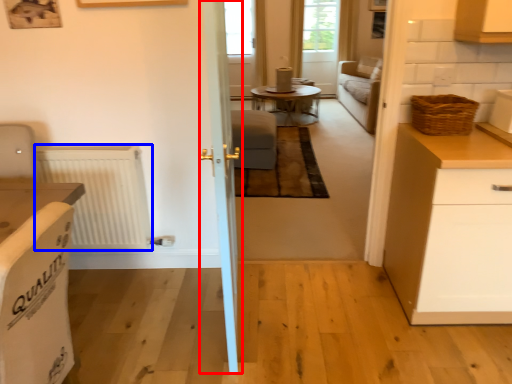
Question: Which of the following is the farthest to the observer, door (highlighted by a red box) or radiator (highlighted by a blue box)?

Choices:
 (A) door
 (B) radiator

Answer: (B)